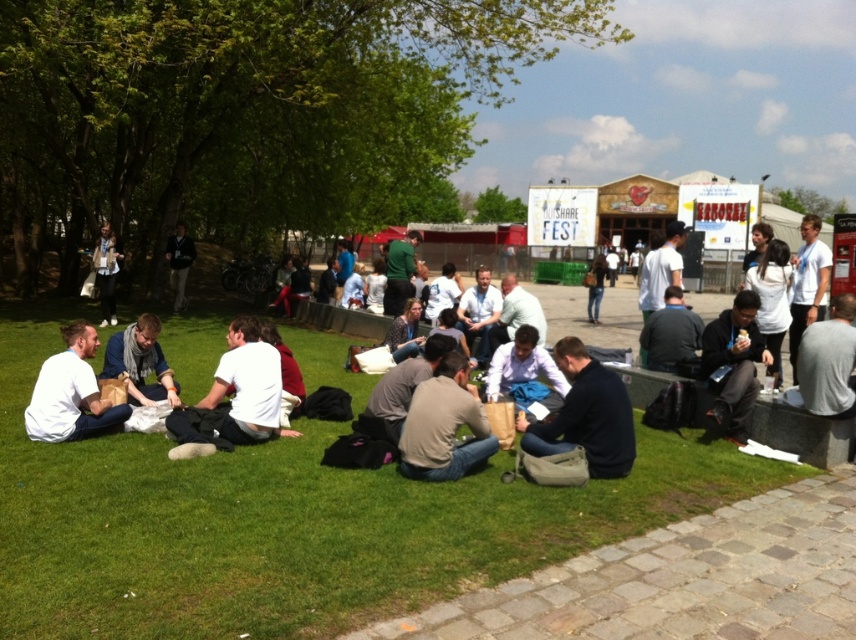
Question: Which point appears farthest from the camera in this image?

Choices:
 (A) (117, 260)
 (B) (183, 292)
 (C) (107, 401)

Answer: (B)

Question: Which point is farther to the camera?

Choices:
 (A) (428, 464)
 (B) (105, 289)

Answer: (B)

Question: Does green grass at lower center have a larger size compared to gray fabric shirt at lower right?

Choices:
 (A) no
 (B) yes

Answer: (B)

Question: Which point is closer to the camera?

Choices:
 (A) dark gray jacket at center
 (B) green grass at lower center
 (C) white cotton shirt at center

Answer: (B)

Question: Is green grass at lower center positioned behind black fabric jacket at lower right?

Choices:
 (A) no
 (B) yes

Answer: (A)

Question: Does green grass at lower center appear on the left side of dark blue jeans at center?

Choices:
 (A) no
 (B) yes

Answer: (B)